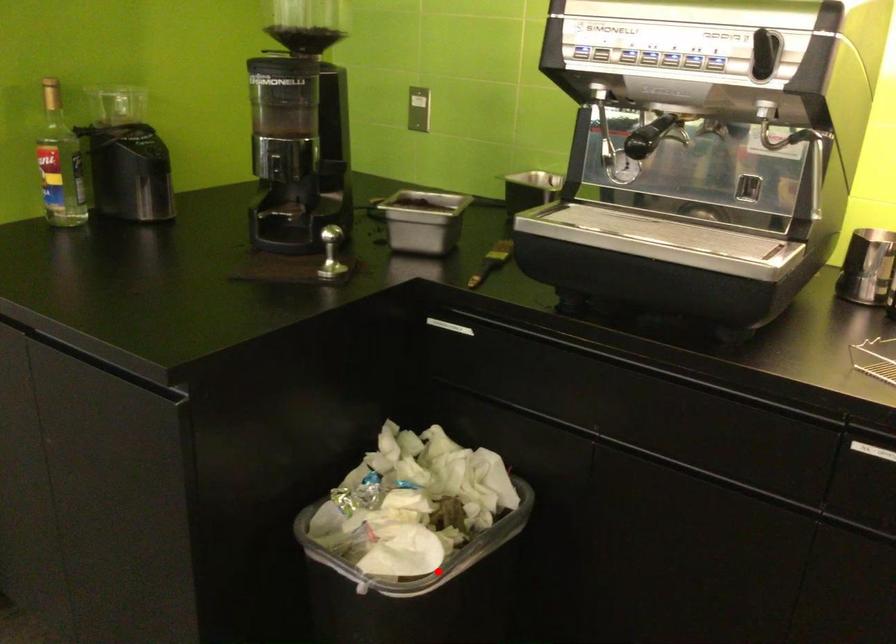
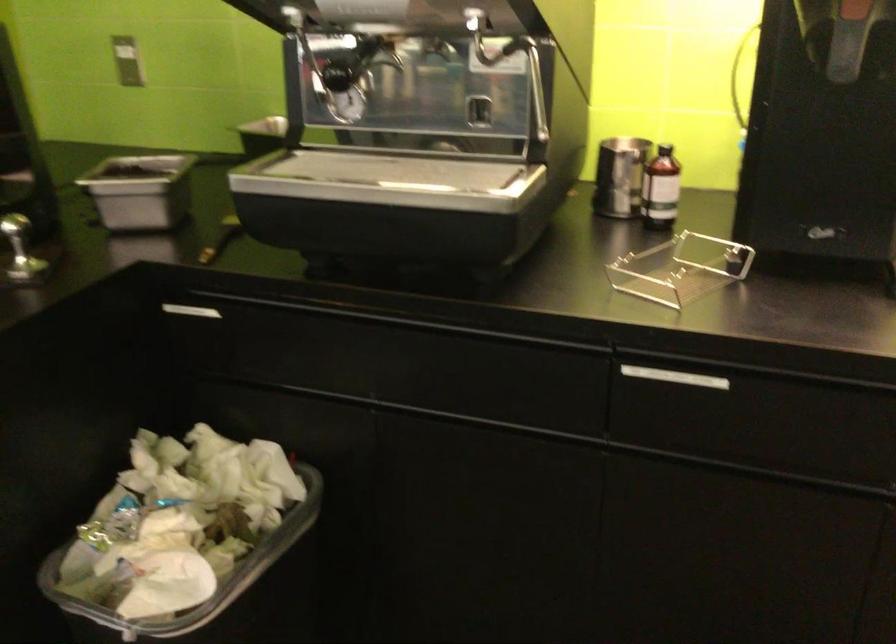
Question: A red point is marked in image1. In image2, is the corresponding 3D point closer to the camera or farther? Reply with the corresponding letter.

Choices:
 (A) The corresponding 3D point is closer.
 (B) The corresponding 3D point is farther.

Answer: (A)